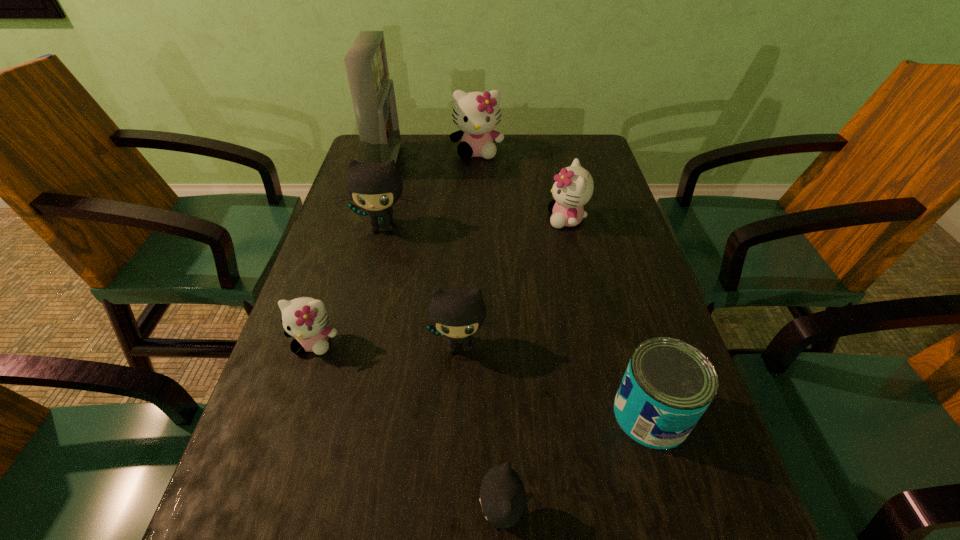
At what (x,y) coordinates should I click in order to perform the action: click on blue can. Please return your answer as a coordinate pair (x, y). Looking at the image, I should click on (668, 384).

Locate an element on the screen. This screenshot has width=960, height=540. the leftmost white kitten is located at coordinates (305, 318).

I want to click on the nearest white kitten, so click(305, 318).

The image size is (960, 540). Find the location of `vacant space located on the front-facing side of the red first-aid kit`. vacant space located on the front-facing side of the red first-aid kit is located at coordinates (437, 161).

What are the coordinates of `vacant area situated on the front-facing side of the farthest white kitten` in the screenshot? It's located at [x=476, y=210].

Locate an element on the screen. The width and height of the screenshot is (960, 540). vacant space located on the front-facing side of the farthest gray kitten is located at coordinates (356, 335).

Where is `vacant point located on the front-facing side of the rightmost kitten`? The width and height of the screenshot is (960, 540). vacant point located on the front-facing side of the rightmost kitten is located at coordinates (415, 219).

Locate an element on the screen. free location located 0.390m on the front-facing side of the rightmost kitten is located at coordinates click(396, 219).

Find the location of `vacant region located on the front-facing side of the rightmost kitten`. vacant region located on the front-facing side of the rightmost kitten is located at coordinates (443, 219).

Locate an element on the screen. The height and width of the screenshot is (540, 960). vacant space situated 0.160m on the front-facing side of the second nearest gray kitten is located at coordinates (455, 446).